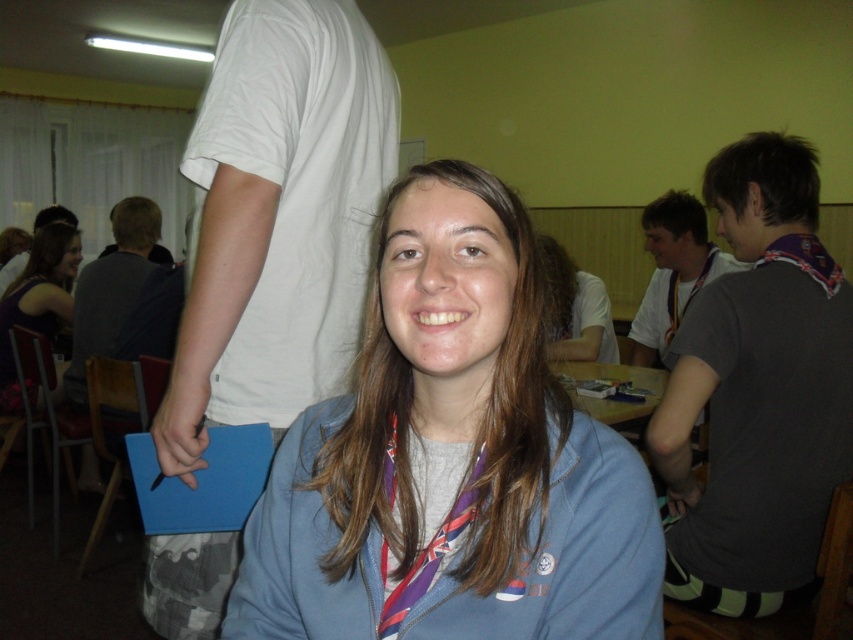
You are a photographer standing 24 inches away from the blue fleece jacket at center. Can you reach it without moving your feet?

The blue fleece jacket at center is 23.64 inches away from the camera, so you can reach it without moving your feet since you are only 24 inches away.

You are organizing a photo shoot and need to ensure that the blue fleece jacket at center and the purple fabric lanyard at upper right are both visible in the frame. Based on their positions, which object is closer to the bottom of the image?

The blue fleece jacket at center is located below the purple fabric lanyard at upper right, so it is closer to the bottom of the image.